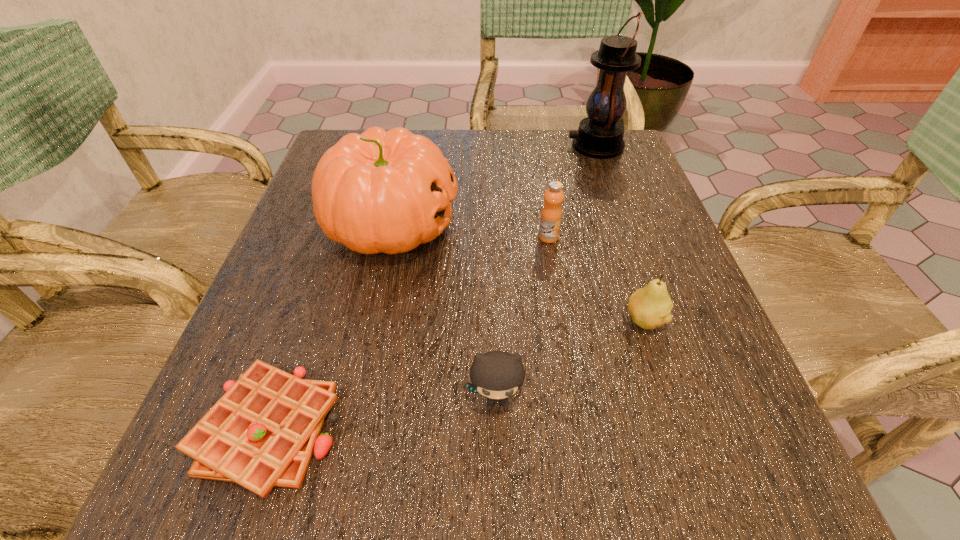
This screenshot has width=960, height=540. Find the location of `the tallest object`. the tallest object is located at coordinates (600, 135).

The height and width of the screenshot is (540, 960). I want to click on lantern, so click(x=600, y=135).

In order to click on pumpkin in this screenshot , I will do pyautogui.click(x=380, y=191).

Locate an element on the screen. orange juice is located at coordinates [x=551, y=215].

Find the location of `the third nearest object`. the third nearest object is located at coordinates (650, 307).

Where is `kitten`? kitten is located at coordinates click(497, 375).

This screenshot has width=960, height=540. Identify the location of waffle. (262, 432).

Where is a free space located 0.090m above the lantern, indicating its light source? Please provide its 2D coordinates. Your answer should be formatted as a tuple, i.e. [(x, y)], where the tuple contains the x and y coordinates of a point satisfying the conditions above.

[(531, 146)]

Pinpoint the vacant space located 0.080m above the lantern, indicating its light source. Please provide its 2D coordinates. Your answer should be formatted as a tuple, i.e. [(x, y)], where the tuple contains the x and y coordinates of a point satisfying the conditions above.

[(535, 146)]

Where is a free space located above the lantern, indicating its light source? Please provide its 2D coordinates. Your answer should be formatted as a tuple, i.e. [(x, y)], where the tuple contains the x and y coordinates of a point satisfying the conditions above.

[(498, 146)]